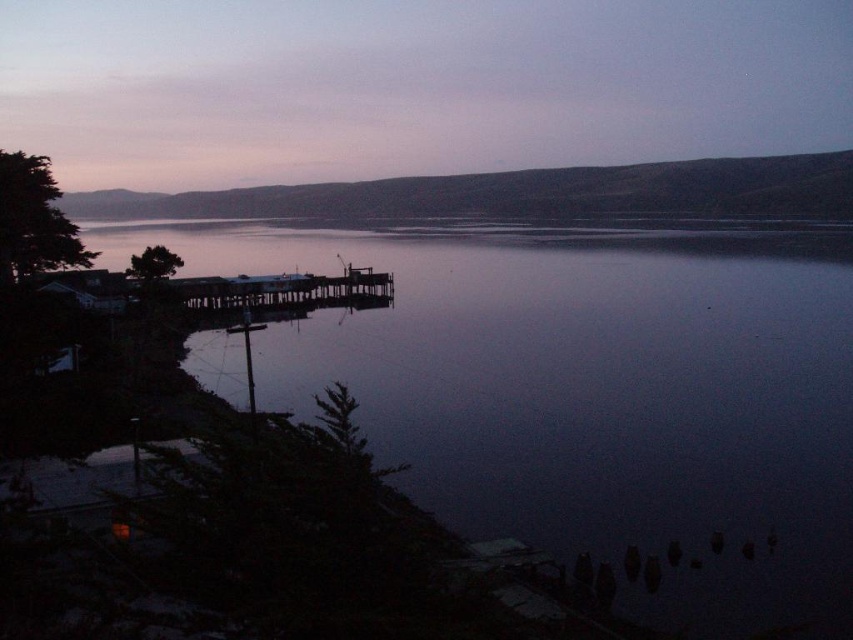
Question: Which of the following is the closest to the observer?

Choices:
 (A) wooden pier at center
 (B) purple matte sky at upper center

Answer: (A)

Question: Where is dark reflective water at center located in relation to purple matte sky at upper center in the image?

Choices:
 (A) left
 (B) right

Answer: (B)

Question: Can you confirm if dark reflective water at center is positioned to the left of purple matte sky at upper center?

Choices:
 (A) no
 (B) yes

Answer: (A)

Question: Which point is closer to the camera?

Choices:
 (A) wooden pier at center
 (B) dark reflective water at center

Answer: (B)

Question: Based on their relative distances, which object is farther from the dark reflective water at center?

Choices:
 (A) purple matte sky at upper center
 (B) wooden pier at center

Answer: (A)

Question: Does purple matte sky at upper center have a greater width compared to wooden pier at center?

Choices:
 (A) yes
 (B) no

Answer: (A)